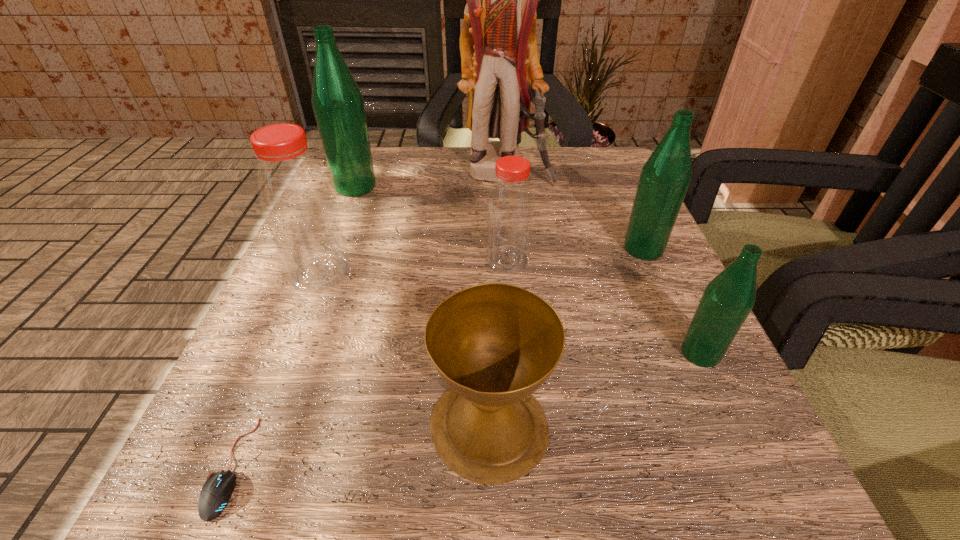
Where is `free space located 0.300m on the right of the mouse`? Image resolution: width=960 pixels, height=540 pixels. free space located 0.300m on the right of the mouse is located at coordinates (519, 466).

Locate an element on the screen. The image size is (960, 540). nutcracker situated at the far edge is located at coordinates (500, 66).

Where is `bottle present at the far edge`? This screenshot has width=960, height=540. bottle present at the far edge is located at coordinates (338, 104).

Find the location of `chalice that is positioned at the near edge`. chalice that is positioned at the near edge is located at coordinates (494, 344).

Find the location of a particular element. The height and width of the screenshot is (540, 960). mouse present at the near edge is located at coordinates (216, 492).

At what (x,y) coordinates should I click in order to perform the action: click on mouse positioned at the left edge. Please return your answer as a coordinate pair (x, y). Image resolution: width=960 pixels, height=540 pixels. Looking at the image, I should click on (216, 492).

Where is `nutcracker that is positioned at the right edge`? The height and width of the screenshot is (540, 960). nutcracker that is positioned at the right edge is located at coordinates (500, 66).

Locate an element on the screen. object located in the far left corner section of the desktop is located at coordinates (338, 104).

This screenshot has height=540, width=960. Identify the location of object located in the near left corner section of the desktop. (216, 492).

At what (x,y) coordinates should I click in order to perform the action: click on object that is at the far right corner. Please return your answer as a coordinate pair (x, y). The image size is (960, 540). Looking at the image, I should click on (500, 66).